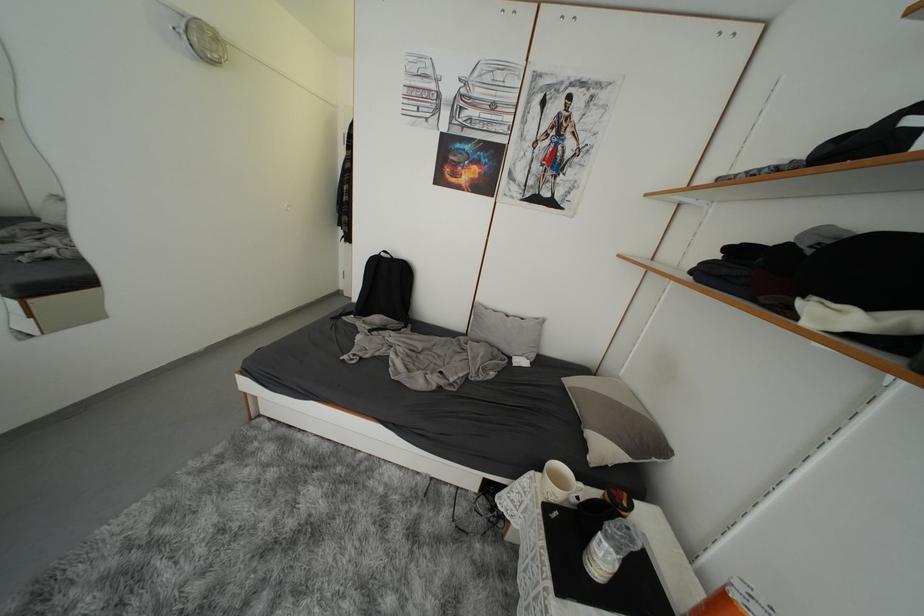
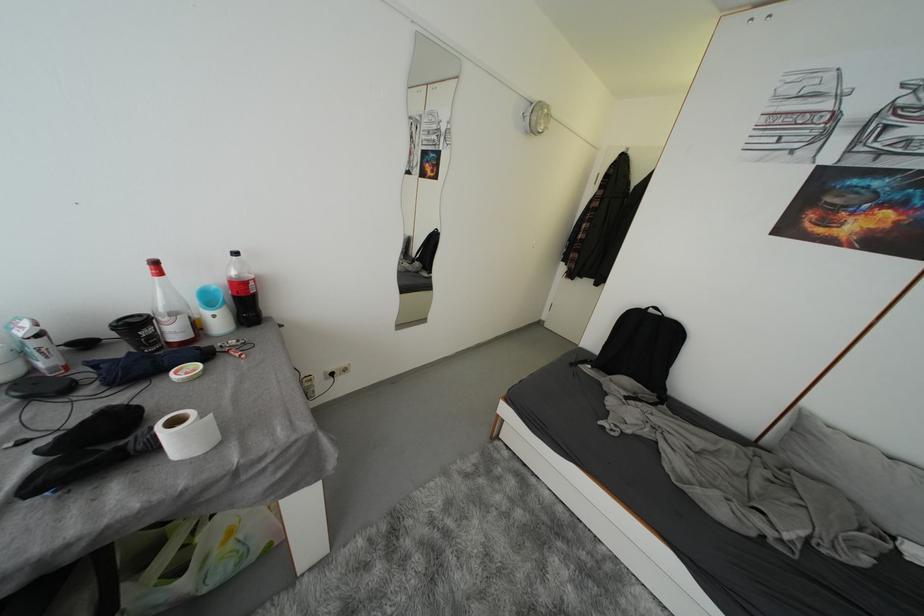
Question: The camera is either moving clockwise (left) or counter-clockwise (right) around the object. The first image is from the beginning of the video and the second image is from the end. Is the camera moving left or right when shooting the video?

Choices:
 (A) Left
 (B) Right

Answer: (B)